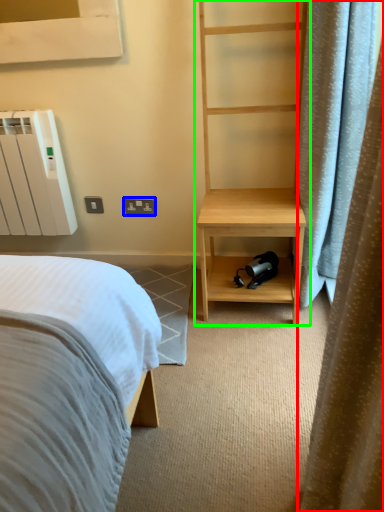
Question: Considering the real-world distances, which object is farthest from curtain (highlighted by a red box)? electric outlet (highlighted by a blue box) or bookshelf (highlighted by a green box)?

Choices:
 (A) electric outlet
 (B) bookshelf

Answer: (A)